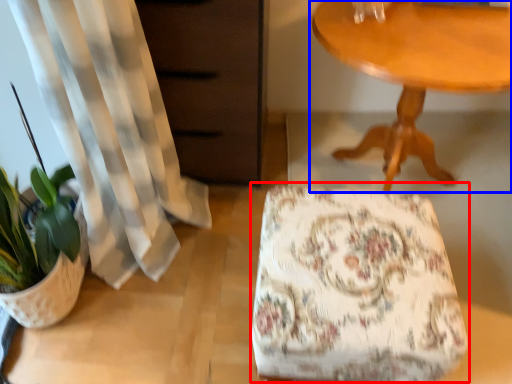
Question: Which point is further to the camera, rocking chair (highlighted by a red box) or table (highlighted by a blue box)?

Choices:
 (A) rocking chair
 (B) table

Answer: (B)